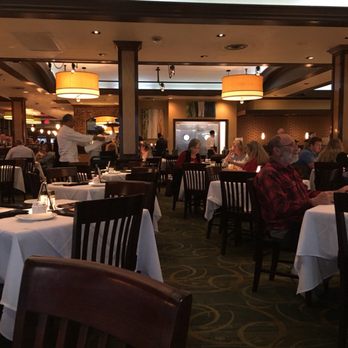
The width and height of the screenshot is (348, 348). In order to click on plate in this screenshot , I will do `click(28, 218)`, `click(29, 198)`.